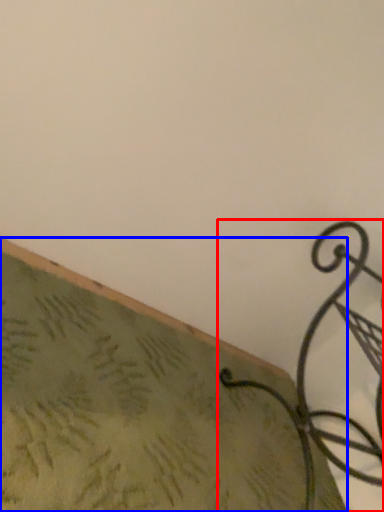
Question: Which object is closer to the camera taking this photo, furniture (highlighted by a red box) or surface (highlighted by a blue box)?

Choices:
 (A) furniture
 (B) surface

Answer: (B)